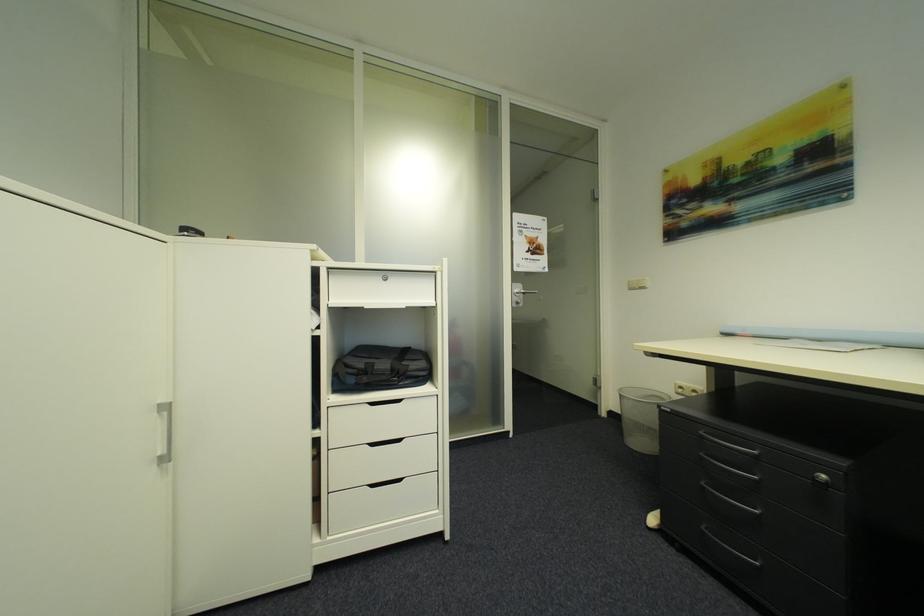
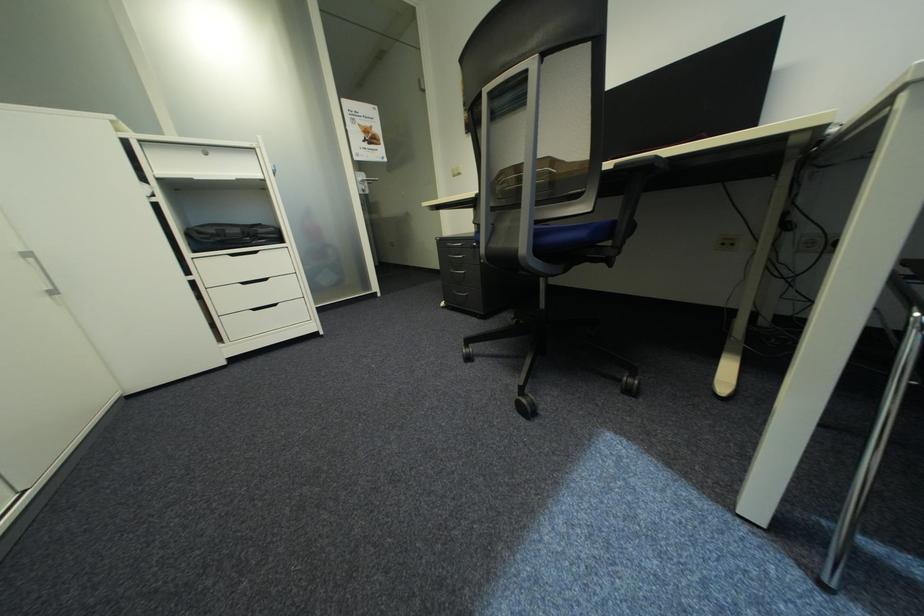
The point at (x=710, y=432) is marked in the first image. Where is the corresponding point in the second image?

(456, 245)